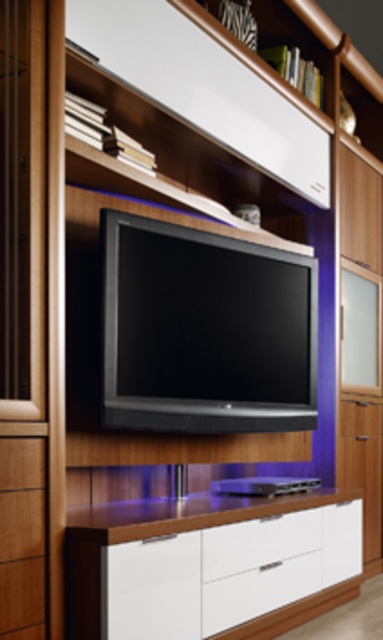
Question: Among these objects, which one is farthest from the camera?

Choices:
 (A) wooden drawer at lower left
 (B) black glossy flat screen tv at center

Answer: (B)

Question: Based on their relative distances, which object is farther from the white glossy drawer at lower center?

Choices:
 (A) black glossy flat screen tv at center
 (B) wooden drawer at lower left

Answer: (A)

Question: Based on their relative distances, which object is farther from the black glossy flat screen tv at center?

Choices:
 (A) white glossy drawer at lower center
 (B) wooden drawer at lower left

Answer: (B)

Question: In this image, where is black glossy flat screen tv at center located relative to wooden drawer at lower left?

Choices:
 (A) above
 (B) below

Answer: (A)

Question: Is black glossy flat screen tv at center positioned at the back of white glossy drawer at lower center?

Choices:
 (A) yes
 (B) no

Answer: (A)

Question: Is black glossy flat screen tv at center to the left of wooden drawer at lower left from the viewer's perspective?

Choices:
 (A) no
 (B) yes

Answer: (A)